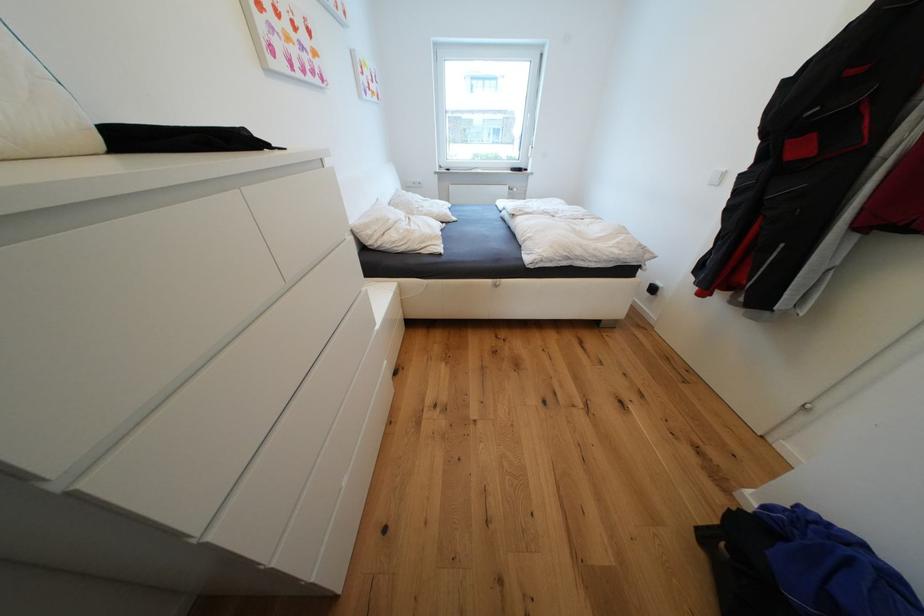
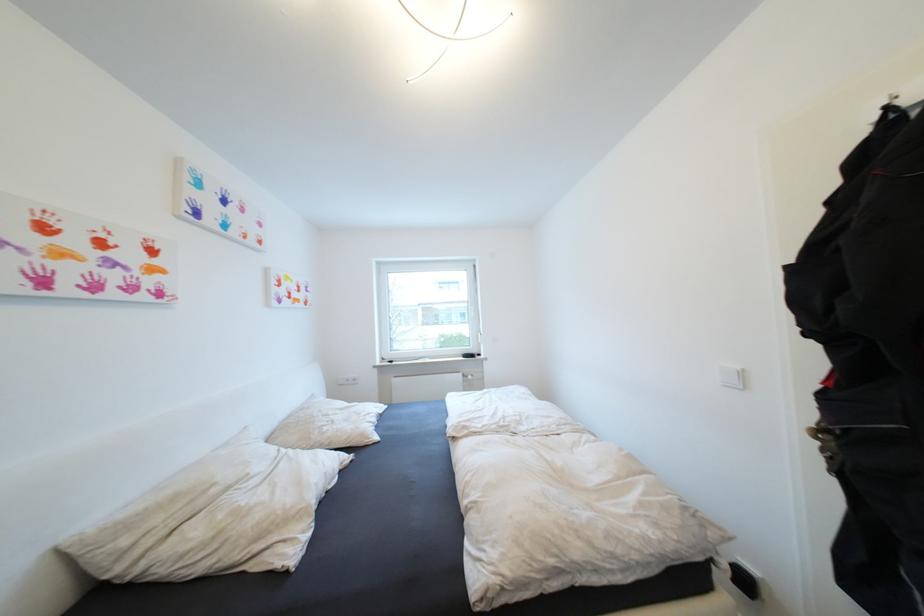
In the second image, find the point that corresponds to the point at 377,233 in the first image.

(131, 543)